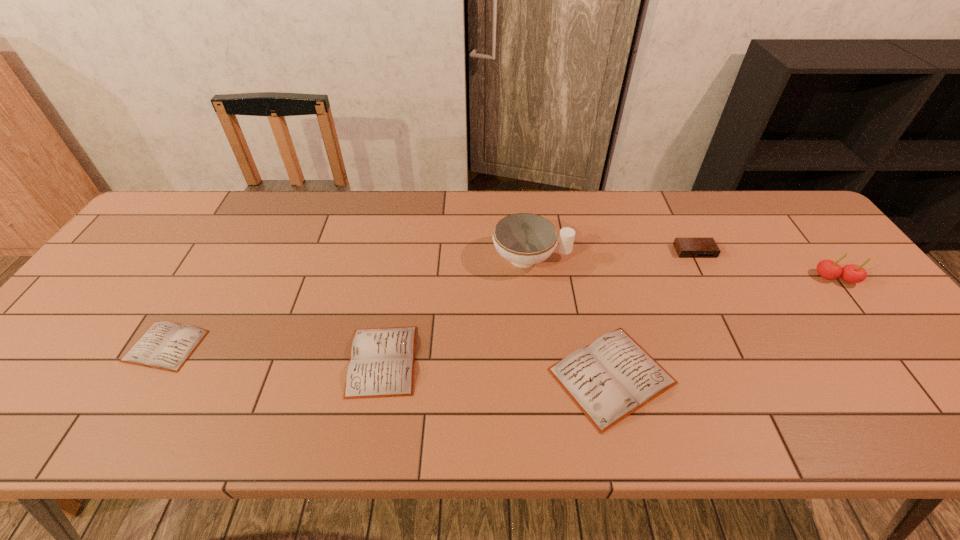
Please point out where to position a new diary on the right to maintain spacing. Please provide its 2D coordinates. Your answer should be formatted as a tuple, i.e. [(x, y)], where the tuple contains the x and y coordinates of a point satisfying the conditions above.

[(854, 393)]